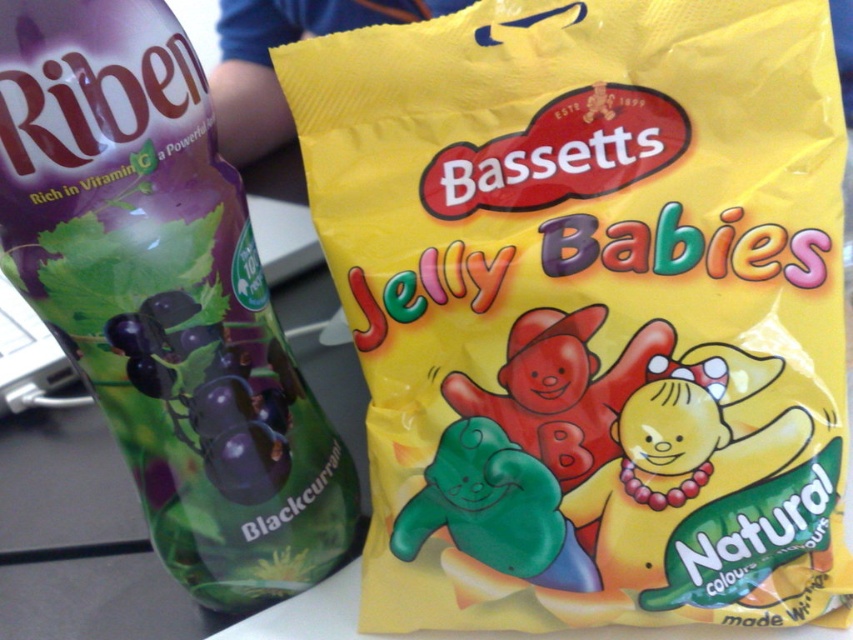
Question: Is yellow matte plastic bag of jelly babies at right to the right of green rubber bear at center from the viewer's perspective?

Choices:
 (A) yes
 (B) no

Answer: (A)

Question: Which point is farther to the camera?

Choices:
 (A) (643, 349)
 (B) (454, 465)
 (C) (189, 84)

Answer: (B)

Question: Estimate the real-world distances between objects in this image. Which object is farther from the translucent purple bottle at left?

Choices:
 (A) yellow matte plastic bag of jelly babies at right
 (B) green rubber bear at center

Answer: (B)

Question: From the image, what is the correct spatial relationship of yellow matte plastic bag of jelly babies at right in relation to green rubber bear at center?

Choices:
 (A) right
 (B) left

Answer: (A)

Question: Is yellow matte plastic bag of jelly babies at right thinner than green rubber bear at center?

Choices:
 (A) no
 (B) yes

Answer: (A)

Question: Which object is closer to the camera taking this photo?

Choices:
 (A) green rubber bear at center
 (B) translucent purple bottle at left

Answer: (B)